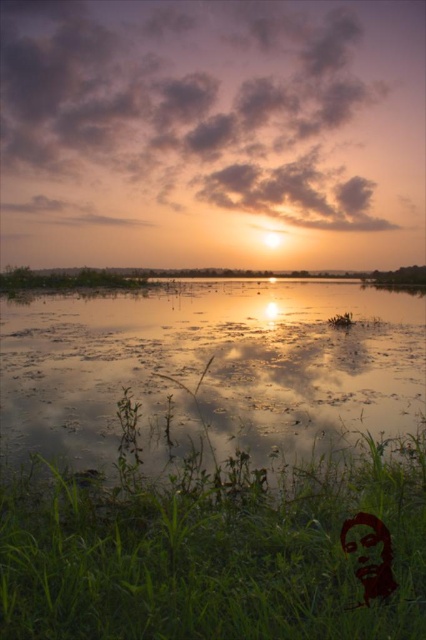
Question: Does green grass at lower left have a greater width compared to translucent reflective water at center?

Choices:
 (A) yes
 (B) no

Answer: (B)

Question: Which object is farther from the camera taking this photo?

Choices:
 (A) smooth red face at lower right
 (B) green grass at lower left

Answer: (A)

Question: Does green grass at lower left appear under silhouette paper person at lower right?

Choices:
 (A) yes
 (B) no

Answer: (A)

Question: Does translucent reflective water at center come in front of silhouette paper person at lower right?

Choices:
 (A) no
 (B) yes

Answer: (A)

Question: Considering the real-world distances, which object is farthest from the smooth red face at lower right?

Choices:
 (A) green grass at lower left
 (B) silhouette paper person at lower right
 (C) translucent reflective water at center

Answer: (C)

Question: Which point is closer to the camera?

Choices:
 (A) smooth red face at lower right
 (B) green grass at lower left

Answer: (B)